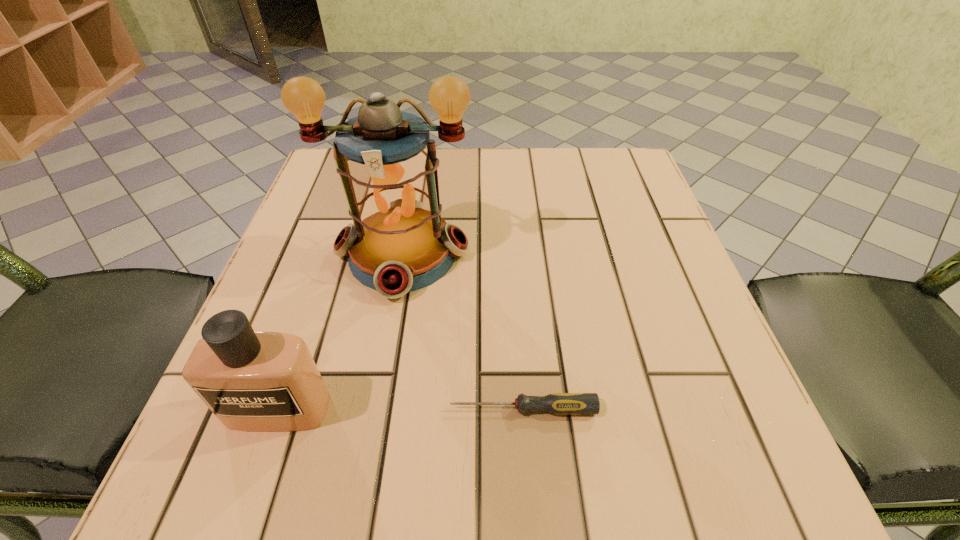
At what (x,y) coordinates should I click in order to perform the action: click on lantern present at the left edge. Please return your answer as a coordinate pair (x, y). Image resolution: width=960 pixels, height=540 pixels. Looking at the image, I should click on (399, 243).

Image resolution: width=960 pixels, height=540 pixels. In order to click on perfume that is at the left edge in this screenshot , I will do `click(251, 380)`.

The width and height of the screenshot is (960, 540). I want to click on object at the near left corner, so click(251, 380).

At what (x,y) coordinates should I click in order to perform the action: click on vacant space at the far edge of the desktop. Please return your answer as a coordinate pair (x, y). The image size is (960, 540). Looking at the image, I should click on (498, 187).

This screenshot has width=960, height=540. In the image, there is a desktop. What are the coordinates of `vacant space at the near edge` in the screenshot? It's located at (561, 433).

Locate an element on the screen. vacant position at the left edge of the desktop is located at coordinates (309, 277).

Where is `free space at the right edge`? The width and height of the screenshot is (960, 540). free space at the right edge is located at coordinates (631, 259).

I want to click on vacant space at the far right corner, so click(x=646, y=183).

This screenshot has height=540, width=960. Identify the location of vacant position at the near right corner of the desktop. (737, 433).

Where is `free space between the second shortest object and the shortest object`? free space between the second shortest object and the shortest object is located at coordinates pos(400,409).